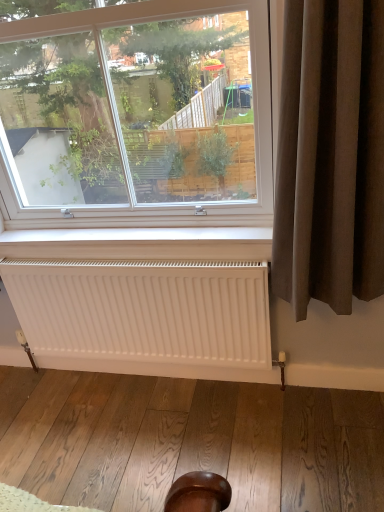
Find the location of `vacant space positioned to the left of white matte radiator at lower center`. vacant space positioned to the left of white matte radiator at lower center is located at coordinates (65, 407).